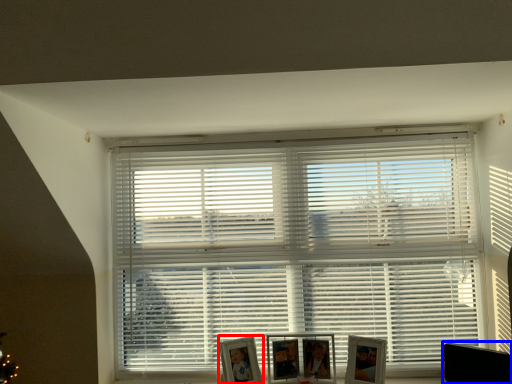
Question: Among these objects, which one is nearest to the camera, picture frame (highlighted by a red box) or swivel chair (highlighted by a blue box)?

Choices:
 (A) picture frame
 (B) swivel chair

Answer: (B)